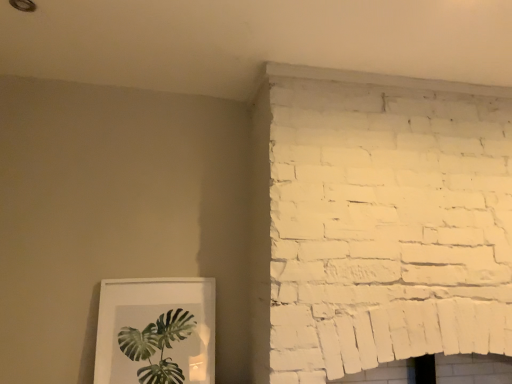
Locate an element on the screen. white matte picture frame at lower left is located at coordinates [x=156, y=331].

The height and width of the screenshot is (384, 512). What do you see at coordinates (156, 331) in the screenshot? I see `white matte picture frame at lower left` at bounding box center [156, 331].

What are the coordinates of `white matte picture frame at lower left` in the screenshot? It's located at (156, 331).